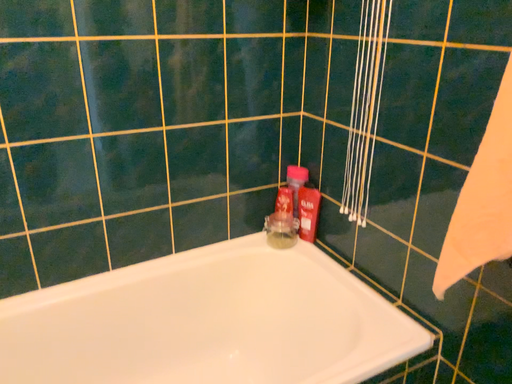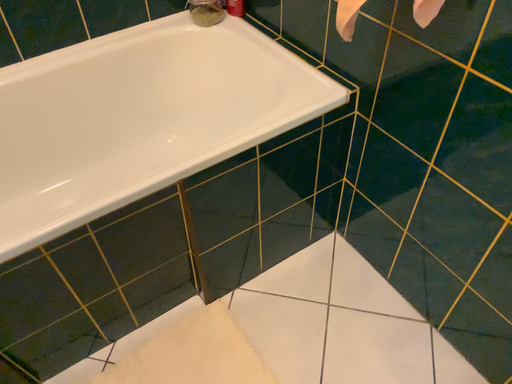
Question: Which way did the camera rotate in the video?

Choices:
 (A) rotated upward
 (B) rotated downward

Answer: (B)